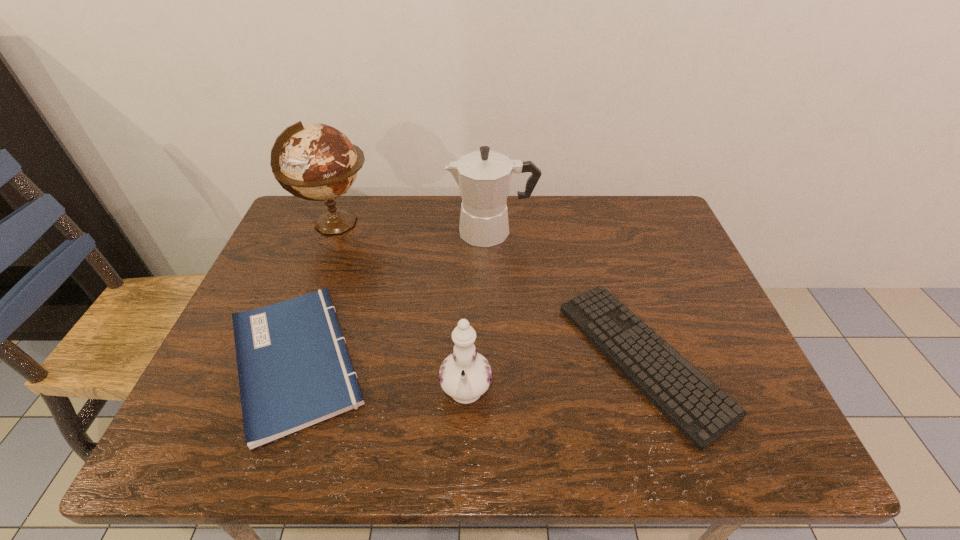
Where is `object that is at the right edge`? The height and width of the screenshot is (540, 960). object that is at the right edge is located at coordinates tap(702, 412).

At what (x,y) coordinates should I click in order to perform the action: click on object positioned at the far left corner. Please return your answer as a coordinate pair (x, y). The image size is (960, 540). Looking at the image, I should click on (318, 162).

Find the location of a particular element. Image resolution: width=960 pixels, height=540 pixels. object at the near left corner is located at coordinates (294, 370).

Where is `object that is positioned at the near right corner`? This screenshot has height=540, width=960. object that is positioned at the near right corner is located at coordinates pyautogui.click(x=702, y=412).

Identify the location of vacant region at the far edge of the desktop. This screenshot has height=540, width=960. (460, 218).

Where is `vacant area at the near edge of the desktop`? The width and height of the screenshot is (960, 540). vacant area at the near edge of the desktop is located at coordinates (437, 457).

This screenshot has width=960, height=540. I want to click on vacant space at the left edge of the desktop, so click(228, 376).

Identify the location of vacant region at the right edge. The width and height of the screenshot is (960, 540). (662, 332).

The image size is (960, 540). In the image, there is a desktop. Identify the location of free space at the far left corner. (302, 220).

Identify the location of free space at the near left corner of the desktop. Image resolution: width=960 pixels, height=540 pixels. (x=222, y=451).